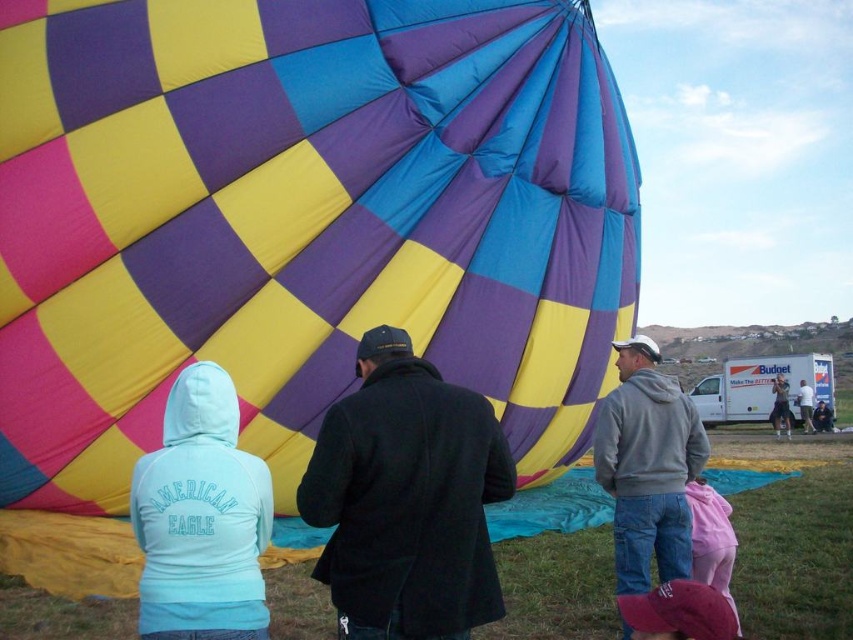
You are a photographer trying to capture the entire hot air balloon in one frame. You notice the gray fleece jacket at right is blocking part of the checkered fabric balloon at center. Since the balloon is larger than the jacket, can you move the jacket to the side to get a clear shot?

Yes, since the checkered fabric balloon at center is larger in size than the gray fleece jacket at right, moving the jacket out of the way would allow you to capture the entire balloon in your photo.

You are standing at the viewpoint where the image was taken. The checkered fabric balloon at center is your main focus. If you take a step forward, will you be closer than 15 meters to the balloon?

The checkered fabric balloon at center is 15.94 meters away from viewer. Taking a step forward would reduce the distance by approximately 0.5 meters, making it 15.44 meters. Since 15.44 meters is still greater than 15 meters, you would still be farther than 15 meters away from the balloon.